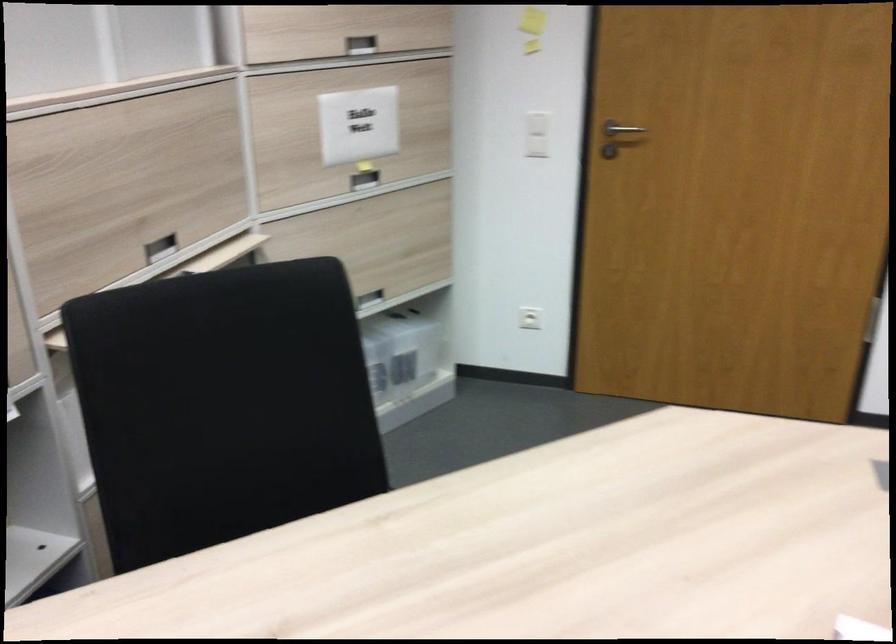
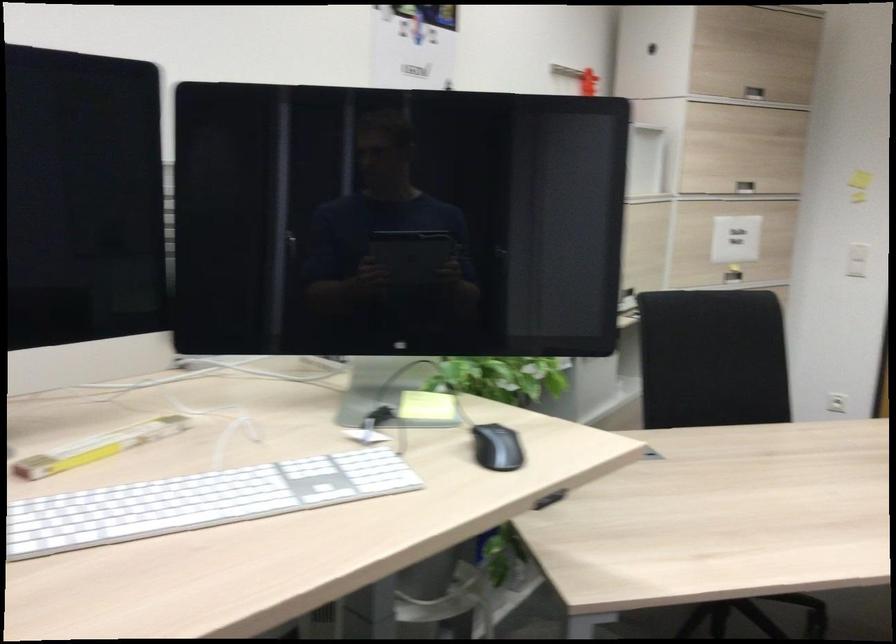
In the second image, find the point that corresponds to [515,136] in the first image.

(857, 260)